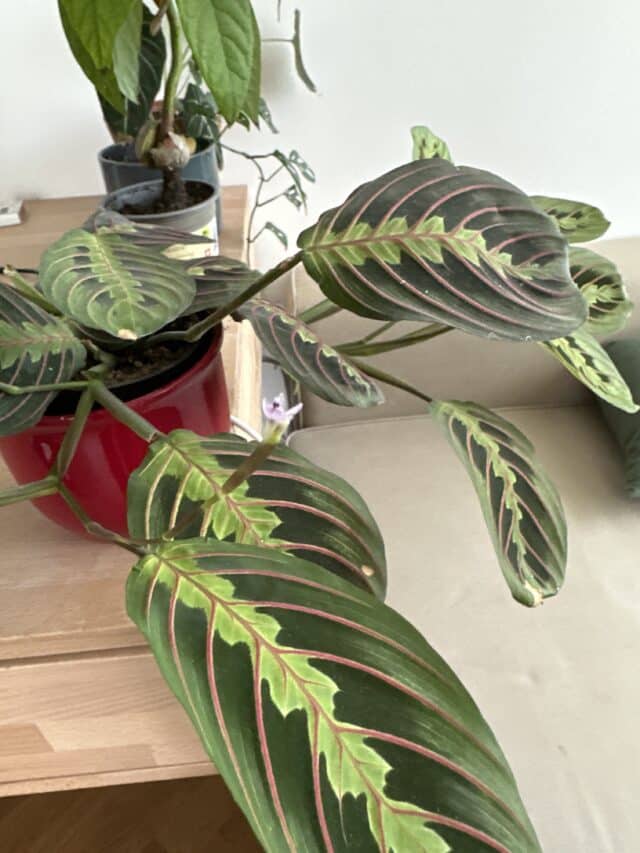
Identify the location of pillow. The image size is (640, 853). (632, 443).